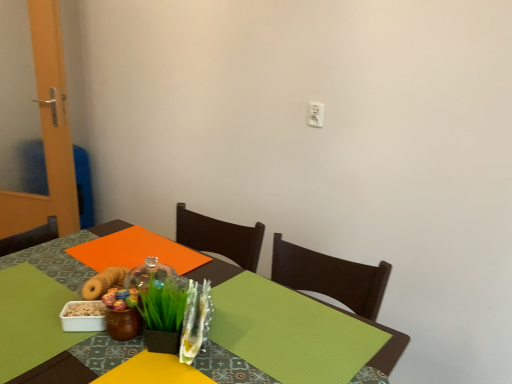
Describe the element at coordinates (315, 114) in the screenshot. This screenshot has height=384, width=512. I see `white plastic electric outlet at upper center` at that location.

The height and width of the screenshot is (384, 512). I want to click on green fabric table at center, so [x=58, y=372].

Describe the element at coordinates (58, 372) in the screenshot. The width and height of the screenshot is (512, 384). I see `green fabric table at center` at that location.

Locate an element on the screen. This screenshot has height=384, width=512. green leafy grass at center is located at coordinates (163, 302).

Can white plastic electric outlet at upper center be found inside green fabric table at center?

Actually, white plastic electric outlet at upper center is outside green fabric table at center.

Does green fabric table at center appear on the left side of white plastic electric outlet at upper center?

Indeed, green fabric table at center is positioned on the left side of white plastic electric outlet at upper center.

Consider the image. Is green fabric table at center bigger or smaller than white plastic electric outlet at upper center?

green fabric table at center is bigger than white plastic electric outlet at upper center.

In the scene shown: From the image's perspective, would you say green fabric table at center is shown under white plastic electric outlet at upper center?

Yes, from the image's perspective, green fabric table at center is beneath white plastic electric outlet at upper center.

Is green fabric table at center wider or thinner than green leafy grass at center?

Clearly, green fabric table at center has more width compared to green leafy grass at center.

Considering the relative sizes of green fabric table at center and green leafy grass at center in the image provided, is green fabric table at center taller than green leafy grass at center?

Yes, green fabric table at center is taller than green leafy grass at center.

Is point (219, 274) farther from viewer compared to point (163, 308)?

Yes, it is.

In the image, is green fabric table at center on the left side or the right side of green leafy grass at center?

In the image, green fabric table at center appears on the left side of green leafy grass at center.

Is white plastic electric outlet at upper center not inside green leafy grass at center?

That's correct, white plastic electric outlet at upper center is outside of green leafy grass at center.

From the image's perspective, is white plastic electric outlet at upper center above or below green leafy grass at center?

Based on their image positions, white plastic electric outlet at upper center is located above green leafy grass at center.

Can you confirm if white plastic electric outlet at upper center is positioned to the right of green leafy grass at center?

Correct, you'll find white plastic electric outlet at upper center to the right of green leafy grass at center.

Is white plastic electric outlet at upper center aimed at green leafy grass at center?

Yes, white plastic electric outlet at upper center is aimed at green leafy grass at center.

Based on their sizes in the image, would you say white plastic electric outlet at upper center is bigger or smaller than green fabric table at center?

In the image, white plastic electric outlet at upper center appears to be smaller than green fabric table at center.

Can you confirm if white plastic electric outlet at upper center is taller than green fabric table at center?

No.

How many degrees apart are the facing directions of white plastic electric outlet at upper center and green fabric table at center?

white plastic electric outlet at upper center and green fabric table at center are facing 1.82 degrees away from each other.

In the scene shown: Is white plastic electric outlet at upper center oriented towards green fabric table at center?

No, white plastic electric outlet at upper center does not turn towards green fabric table at center.

Between green leafy grass at center and green fabric table at center, which one has smaller width?

Thinner between the two is green leafy grass at center.

Are green leafy grass at center and green fabric table at center beside each other?

They are not placed beside each other.

Is point (152, 310) less distant than point (66, 377)?

No, (152, 310) is behind (66, 377).

Does green leafy grass at center turn towards white plastic electric outlet at upper center?

No.

Considering the positions of objects green leafy grass at center and white plastic electric outlet at upper center in the image provided, who is more to the right, green leafy grass at center or white plastic electric outlet at upper center?

white plastic electric outlet at upper center.

Can you confirm if green leafy grass at center is taller than white plastic electric outlet at upper center?

Yes, green leafy grass at center is taller than white plastic electric outlet at upper center.

Does green leafy grass at center lie in front of white plastic electric outlet at upper center?

Yes, the depth of green leafy grass at center is less than that of white plastic electric outlet at upper center.

Identify the location of electric outlet behind the green fabric table at center. (315, 114).

You are a GUI agent. You are given a task and a screenshot of the screen. Output one action in this format:
    pyautogui.click(x=<x>, y=<y>)
    Task: Click on the table below the green leafy grass at center (from a real-world perspective)
    Image resolution: width=512 pixels, height=384 pixels.
    Given the screenshot: What is the action you would take?
    pyautogui.click(x=58, y=372)

Looking at the image, which one is located further to green leafy grass at center, green fabric table at center or white plastic electric outlet at upper center?

white plastic electric outlet at upper center lies further to green leafy grass at center than the other object.

Considering their positions, is green fabric table at center positioned further to white plastic electric outlet at upper center than green leafy grass at center?

green leafy grass at center lies further to white plastic electric outlet at upper center than the other object.

Based on their spatial positions, is white plastic electric outlet at upper center or green leafy grass at center further from green fabric table at center?

white plastic electric outlet at upper center.

Looking at the image, which one is located further to green fabric table at center, green leafy grass at center or white plastic electric outlet at upper center?

Based on the image, white plastic electric outlet at upper center appears to be further to green fabric table at center.

When comparing their distances from white plastic electric outlet at upper center, does green leafy grass at center or green fabric table at center seem further?

green leafy grass at center.

When comparing their distances from green leafy grass at center, does white plastic electric outlet at upper center or green fabric table at center seem closer?

Among the two, green fabric table at center is located nearer to green leafy grass at center.

Locate an element on the screen. grass positioned between green fabric table at center and white plastic electric outlet at upper center from near to far is located at coordinates (163, 302).